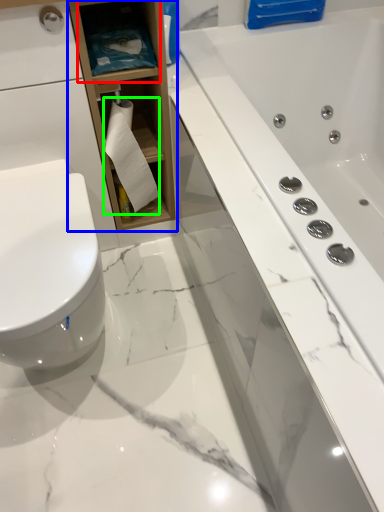
Question: Based on their relative distances, which object is farther from shelf (highlighted by a red box)? Choose from bathroom cabinet (highlighted by a blue box) and toilet paper (highlighted by a green box).

Choices:
 (A) bathroom cabinet
 (B) toilet paper

Answer: (B)